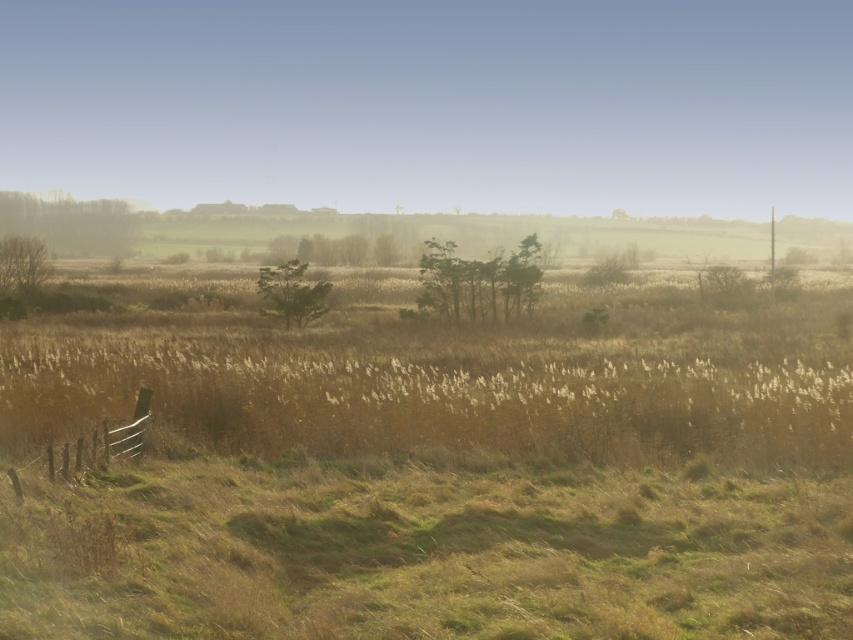
Question: Which object is farther from the camera taking this photo?

Choices:
 (A) brown wooden fence at lower left
 (B) green matte trees at center

Answer: (B)

Question: Among these points, which one is nearest to the camera?

Choices:
 (A) (119, 436)
 (B) (82, 202)
 (C) (24, 253)
 (D) (537, 246)

Answer: (A)

Question: Which is farther from the brown wooden fence at lower left?

Choices:
 (A) green matte tree at center
 (B) green matte trees at center

Answer: (B)

Question: Is green matte trees at center to the left of brown wooden fence at lower left from the viewer's perspective?

Choices:
 (A) no
 (B) yes

Answer: (A)

Question: Is green matte trees at center positioned at the back of brown wooden fence at lower left?

Choices:
 (A) yes
 (B) no

Answer: (A)

Question: Does brown textured tree at upper left appear on the right side of green matte tree at center?

Choices:
 (A) no
 (B) yes

Answer: (A)